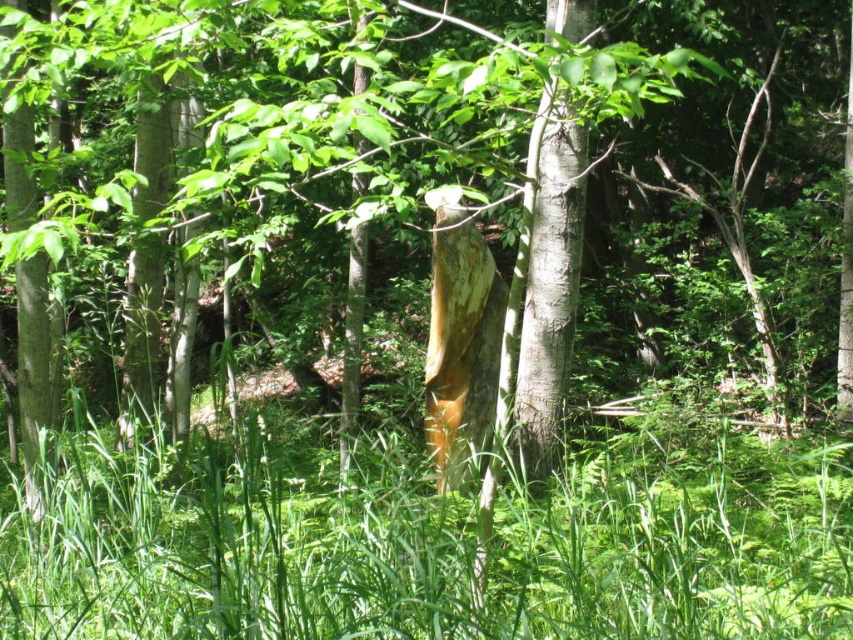
You are a hiker trying to navigate through the forest. You need to step over an obstacle. Which object between the green grass at center and the smooth white tree trunk at center would you choose to step over?

The green grass at center is larger in size than the smooth white tree trunk at center, so stepping over the smooth white tree trunk at center would be easier as it is smaller in size.

You are a hiker who wants to take a photo of the smooth white tree trunk at center. Since you are standing on the green grass at center, can you easily see the tree trunk without any obstruction?

The green grass at center is located below smooth white tree trunk at center, so yes, the tree trunk is visible from the grass since it is positioned above it.